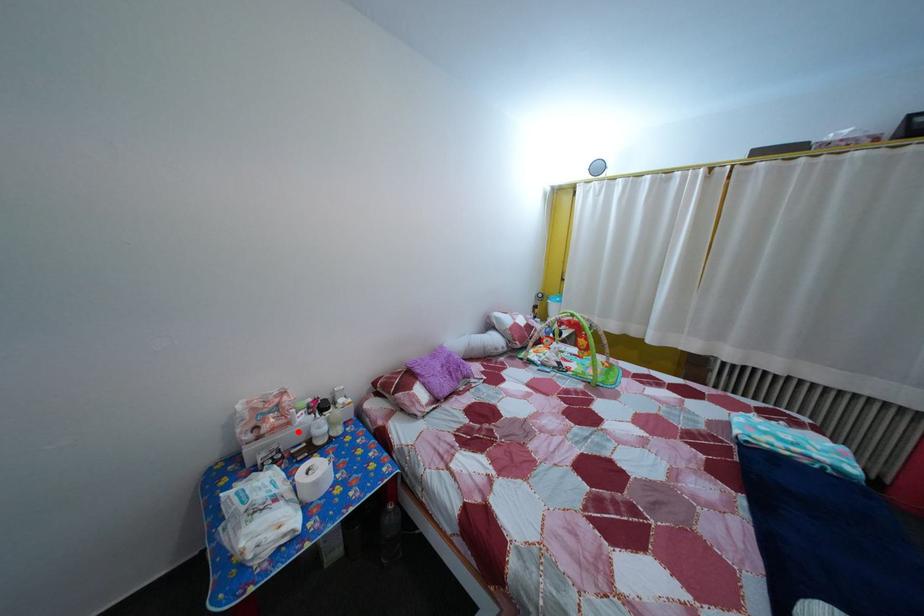
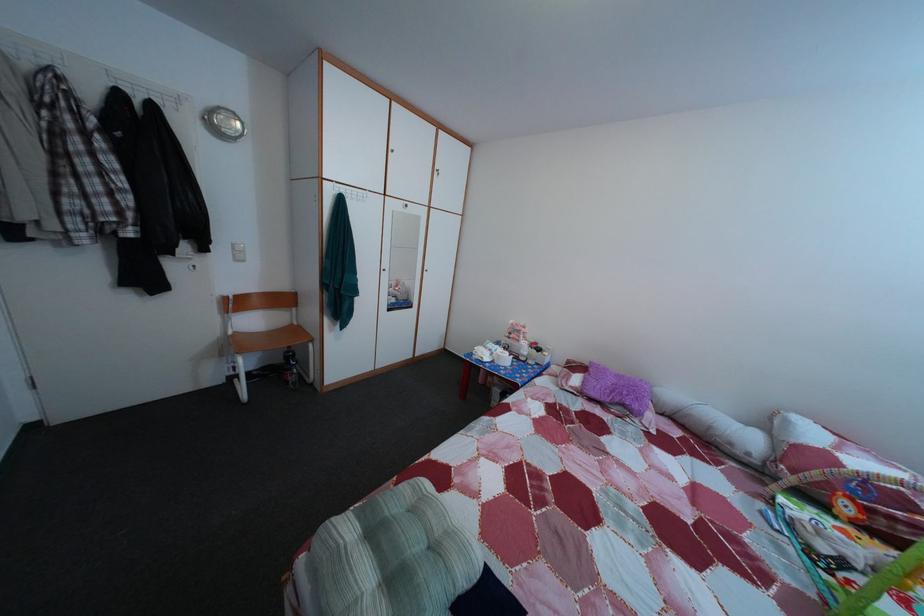
Locate, in the second image, the point that corresponds to the highlighted location in the first image.

(528, 349)